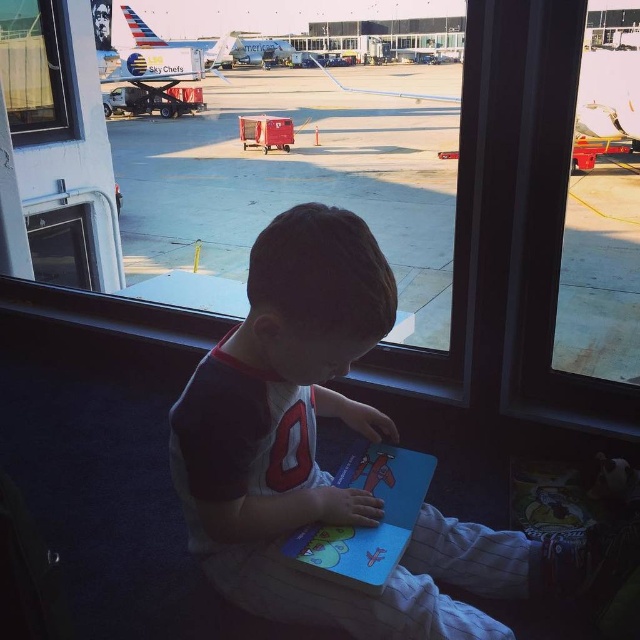
You are a pilot preparing for takeoff and need to check the clearance between the metallic silver airplane at center and the white glossy airplane at upper center. Based on the scene, which airplane is taller?

The metallic silver airplane at center is taller than the white glossy airplane at upper center.

You are a parent trying to find your child who is sitting on a bench in the airport terminal. You see the matte blue book at center and the white glossy airplane at upper center. Which object is located above the other?

The white glossy airplane at upper center is located above the matte blue book at center because the book is positioned under the airplane.

You are a passenger waiting at the airport terminal. You see a metallic silver airplane at center and a white glossy airplane at upper center through the window. Which airplane is closer to you?

The metallic silver airplane at center is closer to you because it is in front of the white glossy airplane at upper center.